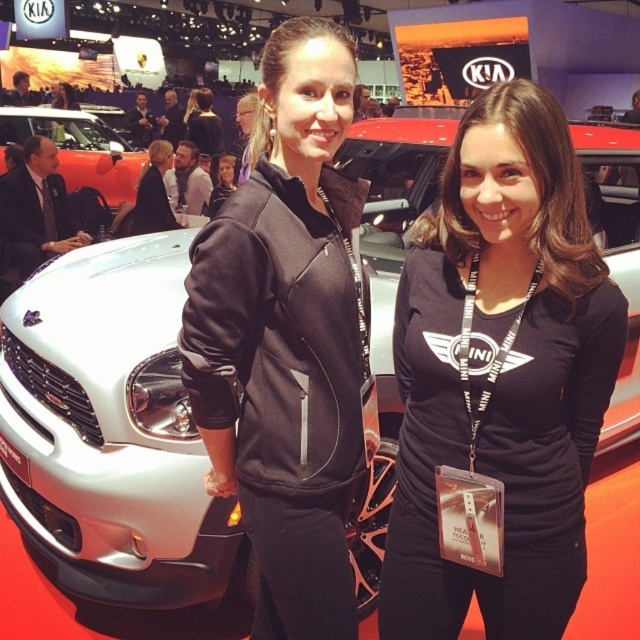
Who is shorter, black jersey at center or matte black hoodie at center?

matte black hoodie at center

Does black jersey at center have a lesser height compared to matte black hoodie at center?

No, black jersey at center is not shorter than matte black hoodie at center.

Where is `black jersey at center`? This screenshot has height=640, width=640. black jersey at center is located at coordinates (500, 372).

Who is more forward, [321,273] or [234,156]?

Point [321,273]

Can you confirm if black matte tracksuit at center is shorter than matte black hoodie at center?

No.

Does point (291, 406) lie behind point (228, 173)?

No, (291, 406) is in front of (228, 173).

In order to click on black matte tracksuit at center in this screenshot , I will do `click(288, 337)`.

Does black jersey at center have a larger size compared to black matte tracksuit at center?

No.

Who is more distant from viewer, [524,557] or [248,272]?

The point [524,557] is more distant.

Who is more distant from viewer, (484, 161) or (259, 406)?

The point (259, 406) is behind.

I want to click on black jersey at center, so click(x=500, y=372).